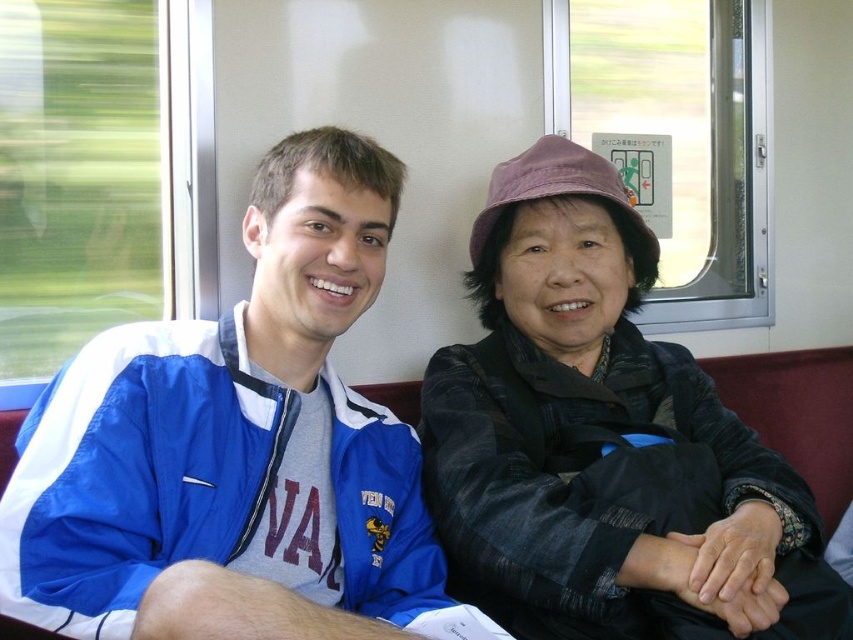
Which is below, blue nylon jacket at left or dark gray textured jacket at center?

dark gray textured jacket at center is lower down.

Can you confirm if blue nylon jacket at left is positioned below dark gray textured jacket at center?

No.

In order to click on blue nylon jacket at left in this screenshot , I will do `click(233, 433)`.

Locate an element on the screen. Image resolution: width=853 pixels, height=640 pixels. blue nylon jacket at left is located at coordinates (233, 433).